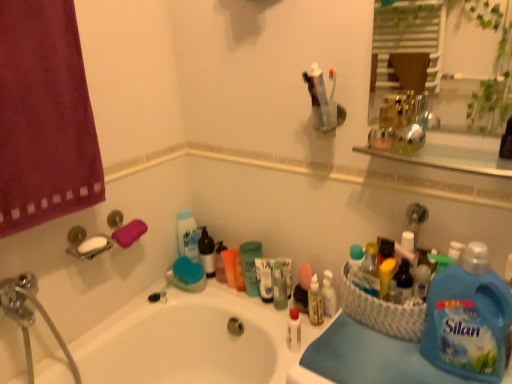
Question: Is translucent plastic bottle at center, which is the 1th toiletry from back to front, directly adjacent to white glossy bathtub at center?

Choices:
 (A) yes
 (B) no

Answer: (B)

Question: From a real-world perspective, is translucent plastic bottle at center, which is the second toiletry in front-to-back order, beneath white glossy bathtub at center?

Choices:
 (A) yes
 (B) no

Answer: (B)

Question: Is translucent plastic bottle at center, which is the 1th toiletry from back to front, wider than white glossy bathtub at center?

Choices:
 (A) yes
 (B) no

Answer: (B)

Question: Considering the relative positions of translucent plastic bottle at center, which is the 1th toiletry from back to front, and white glossy bathtub at center in the image provided, is translucent plastic bottle at center, which is the 1th toiletry from back to front, to the left of white glossy bathtub at center from the viewer's perspective?

Choices:
 (A) no
 (B) yes

Answer: (A)

Question: Does translucent plastic bottle at center, which is the second toiletry in front-to-back order, appear on the right side of white glossy bathtub at center?

Choices:
 (A) yes
 (B) no

Answer: (A)

Question: From a real-world perspective, is translucent plastic bottle at center, which is counted as the first toiletry, starting from the right, located higher than white glossy bathtub at center?

Choices:
 (A) no
 (B) yes

Answer: (B)

Question: Is purple cotton towel at left smaller than white glossy bottle at center, the 1th toiletry when ordered from left to right?

Choices:
 (A) yes
 (B) no

Answer: (B)

Question: Is purple cotton towel at left positioned in front of white glossy bottle at center, the 1th toiletry when ordered from left to right?

Choices:
 (A) yes
 (B) no

Answer: (A)

Question: From a real-world perspective, is purple cotton towel at left located beneath white glossy bottle at center, the 1th toiletry when ordered from front to back?

Choices:
 (A) yes
 (B) no

Answer: (B)

Question: Is purple cotton towel at left located outside white glossy bottle at center, the 1th toiletry when ordered from left to right?

Choices:
 (A) no
 (B) yes

Answer: (B)

Question: Does purple cotton towel at left have a lesser height compared to white glossy bottle at center, marked as the second toiletry in a back-to-front arrangement?

Choices:
 (A) no
 (B) yes

Answer: (A)

Question: Is white glossy bottle at center, the 1th toiletry when ordered from front to back, inside purple cotton towel at left?

Choices:
 (A) no
 (B) yes

Answer: (A)

Question: Is blue fabric at lower right oriented towards translucent plastic bottle at center, which is the second toiletry in front-to-back order?

Choices:
 (A) no
 (B) yes

Answer: (A)